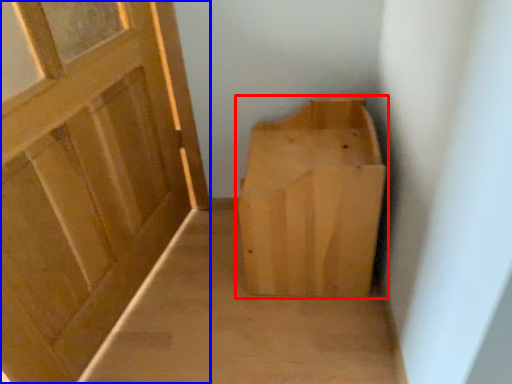
Question: Which point is further to the camera, furniture (highlighted by a red box) or door (highlighted by a blue box)?

Choices:
 (A) furniture
 (B) door

Answer: (A)